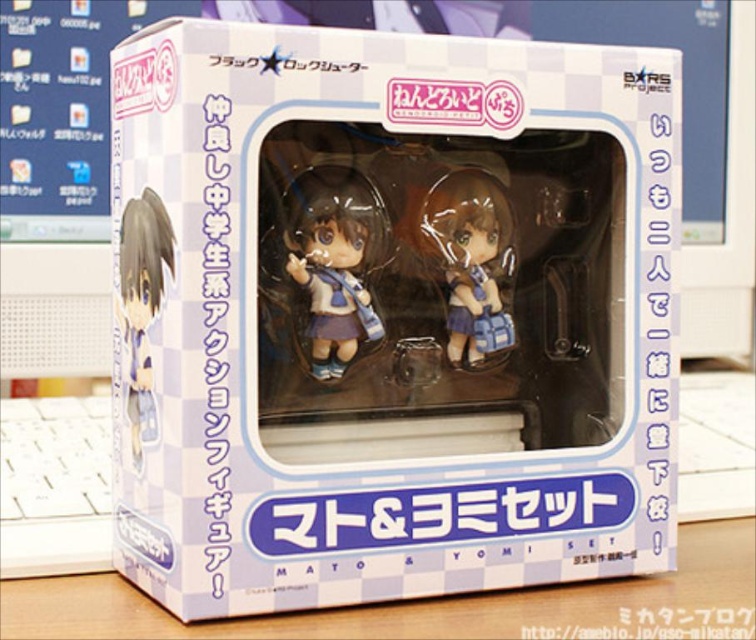
Looking at this image, you are a customer looking at the box from the front. The box has a point marked at coordinates (389, 314). What object is located at this point?

The white glossy box at center is located at the coordinates (389, 314).

You are holding the box at a distance of 30.43 inches from your eyes. The box has a transparent window where you can see the figurines. There is a point marked at coordinate point (547, 148). Can you see this point clearly through the window?

The point (547, 148) is 30.43 inches away from the camera, so yes, you can see it clearly through the window since it is within the viewing distance.

You are a collector looking at the box containing the two figurines. You want to place a new label on the white glossy box at center and the matte blue plastic figurine at left. Which object should you place the label on the left side of?

The white glossy box at center is to the right of the matte blue plastic figurine at left, so you should place the label on the left side of the matte blue plastic figurine at left.